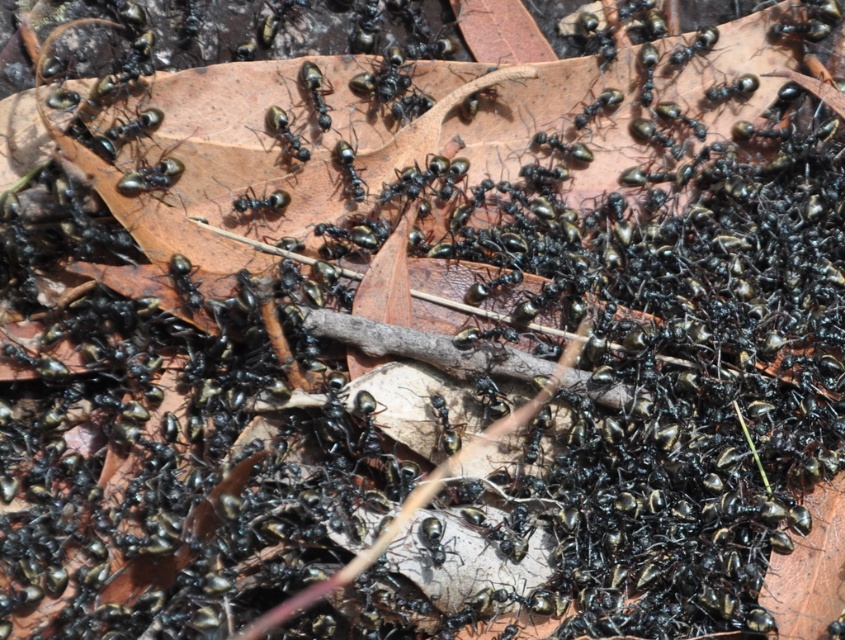
Is the position of shiny black ant at center more distant than that of black shiny ant at center?

No.

Is point (178, 161) less distant than point (273, 211)?

Yes, it is in front of point (273, 211).

Locate an element on the screen. Image resolution: width=845 pixels, height=640 pixels. shiny black ant at center is located at coordinates (150, 177).